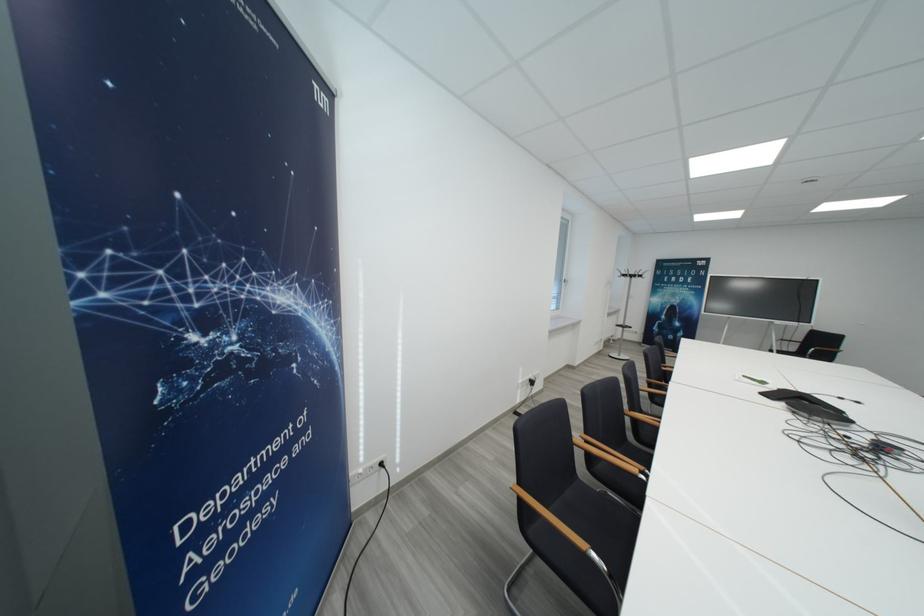
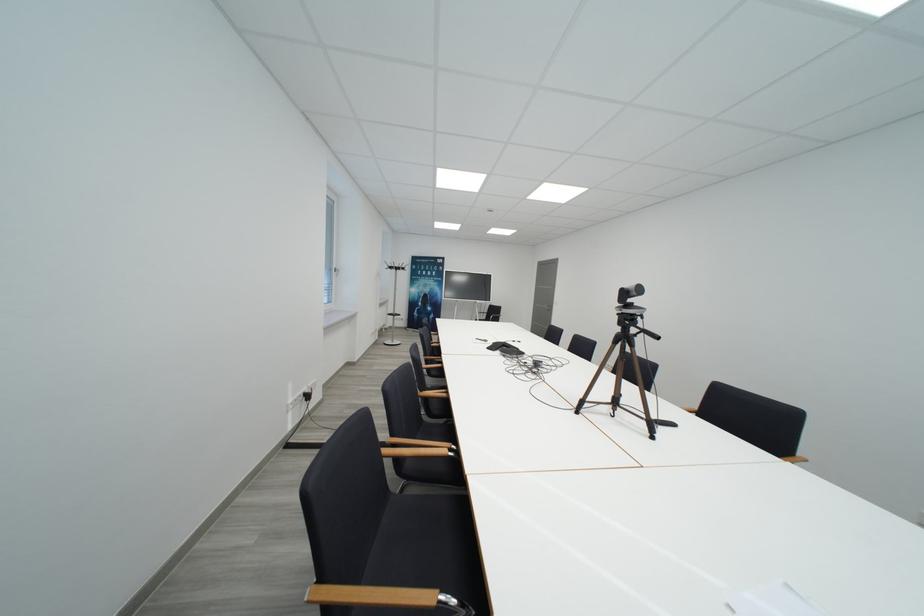
Find the pixel in the second image that matches the point at 771,386 in the first image.

(492, 344)